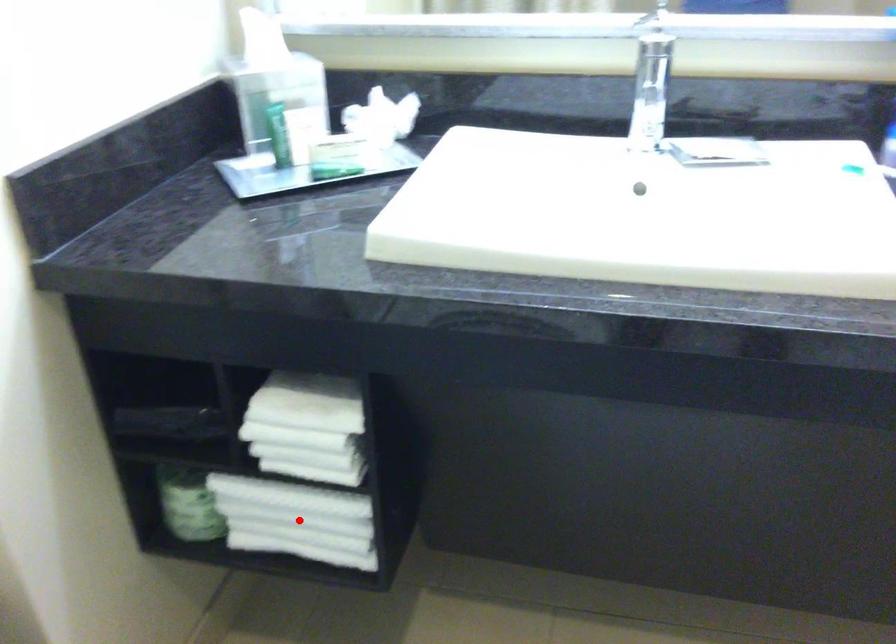
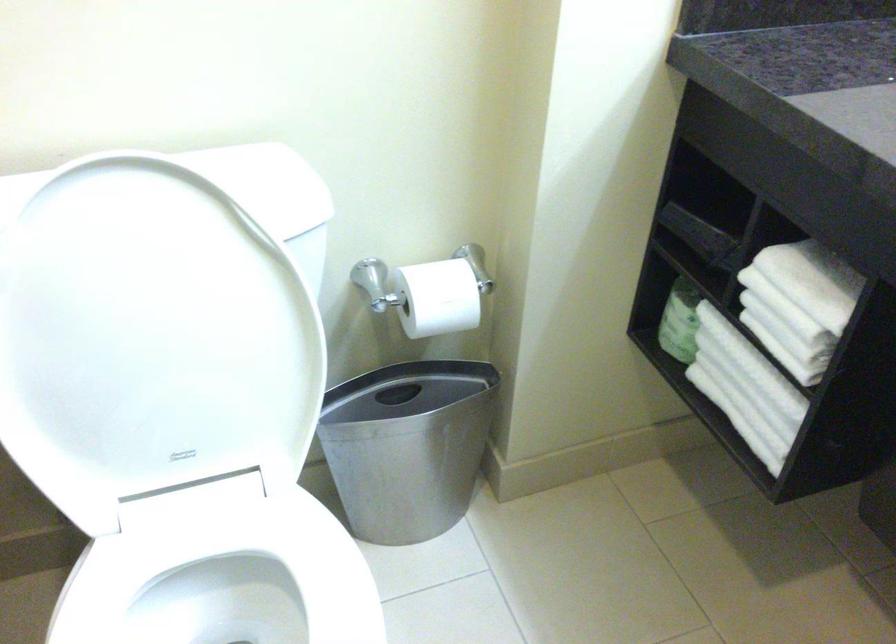
Locate, in the second image, the point that corresponds to the highlighted location in the first image.

(745, 388)